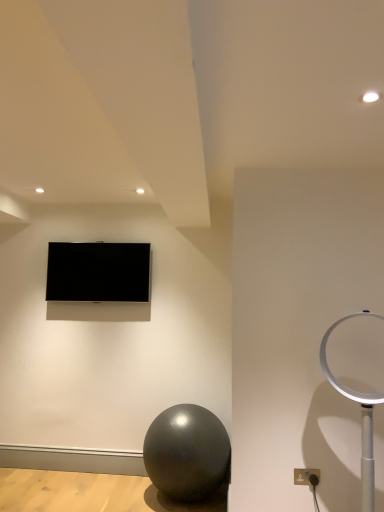
You are a GUI agent. You are given a task and a screenshot of the screen. Output one action in this format:
    pyautogui.click(x=<x>, y=<y>)
    Task: Click on the empty space that is ontop of matte black tv at upper center (from a real-world perspective)
    Image resolution: width=384 pixels, height=512 pixels.
    Given the screenshot: What is the action you would take?
    pyautogui.click(x=109, y=239)